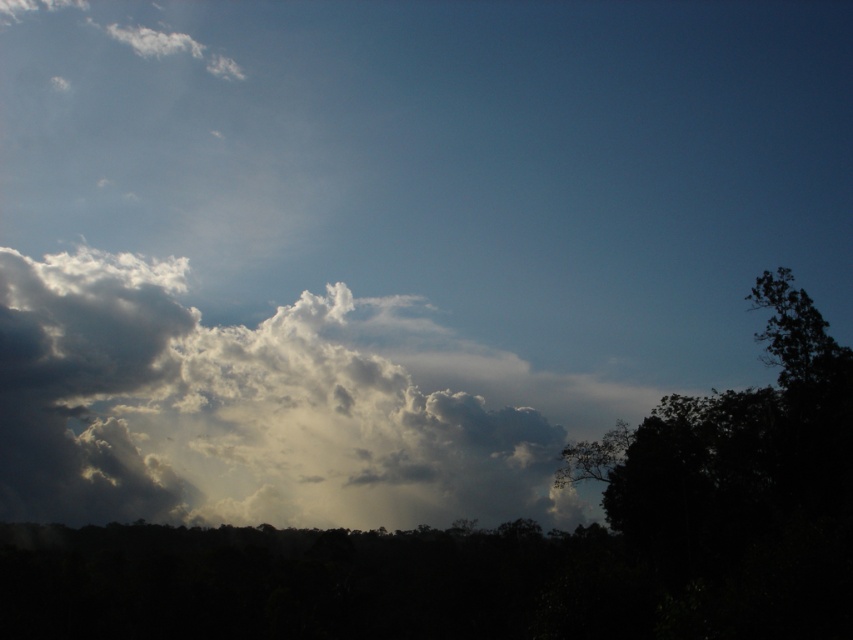
You are an airplane passenger looking out the window and see the white fluffy cloud at upper left and the dark green leafy tree at right. Which object is closer to the left side of your view?

The white fluffy cloud at upper left is positioned on the left side of the dark green leafy tree at right, so it is closer to the left side of your view.